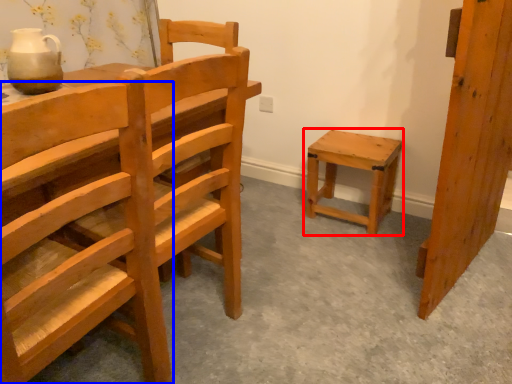
Question: Among these objects, which one is nearest to the camera, stool (highlighted by a red box) or chair (highlighted by a blue box)?

Choices:
 (A) stool
 (B) chair

Answer: (B)